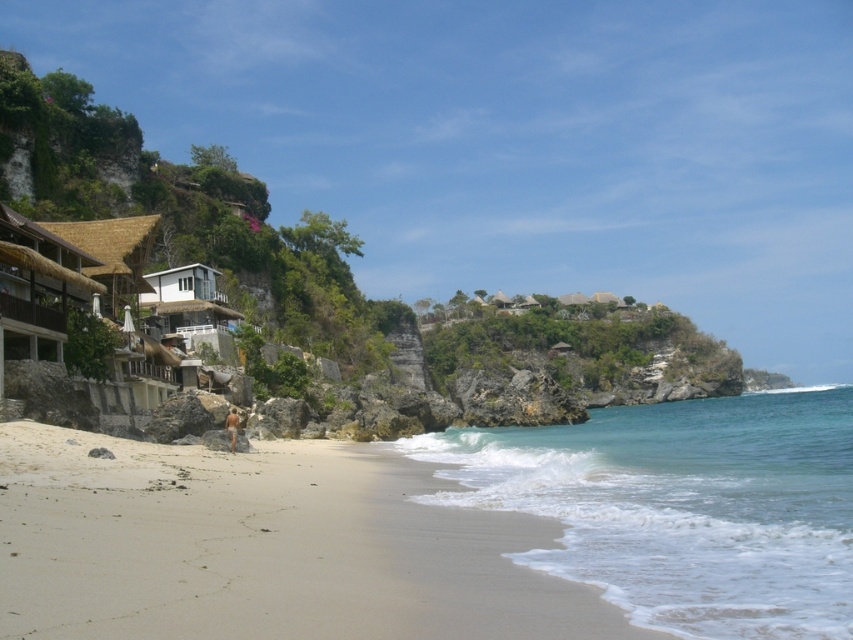
Question: Which point is farther to the camera?

Choices:
 (A) fine-grained sand at lower left
 (B) brown skin at lower center
 (C) clear blue water at lower right

Answer: (B)

Question: Is the position of fine-grained sand at lower left more distant than that of brown skin at lower center?

Choices:
 (A) yes
 (B) no

Answer: (B)

Question: Which object is closer to the camera taking this photo?

Choices:
 (A) brown skin at lower center
 (B) clear blue water at lower right
 (C) fine-grained sand at lower left

Answer: (C)

Question: Is fine-grained sand at lower left to the left of brown skin at lower center from the viewer's perspective?

Choices:
 (A) yes
 (B) no

Answer: (B)

Question: Is fine-grained sand at lower left positioned in front of clear blue water at lower right?

Choices:
 (A) yes
 (B) no

Answer: (A)

Question: Which of the following is the closest to the observer?

Choices:
 (A) (33, 508)
 (B) (722, 465)

Answer: (A)